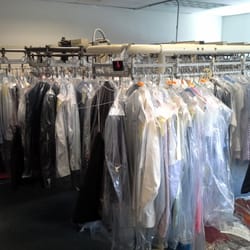
Identify the location of wall. (121, 23).